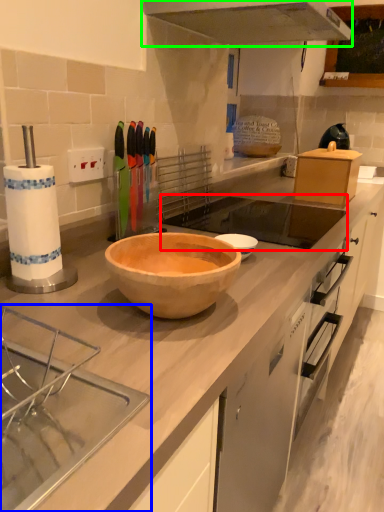
Question: Which object is the farthest from sink (highlighted by a red box)? Choose among these: sink (highlighted by a blue box) or exhaust hood (highlighted by a green box).

Choices:
 (A) sink
 (B) exhaust hood

Answer: (A)